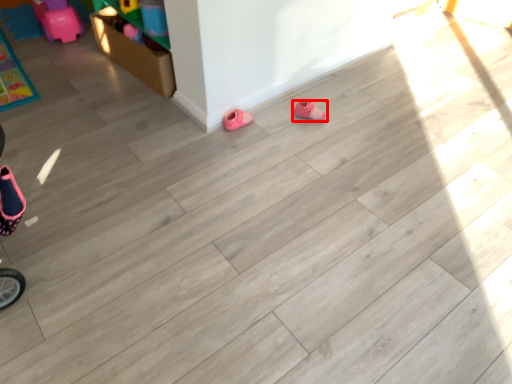
Question: Where is footwear (annotated by the red box) located in relation to footwear in the image?

Choices:
 (A) left
 (B) right

Answer: (B)